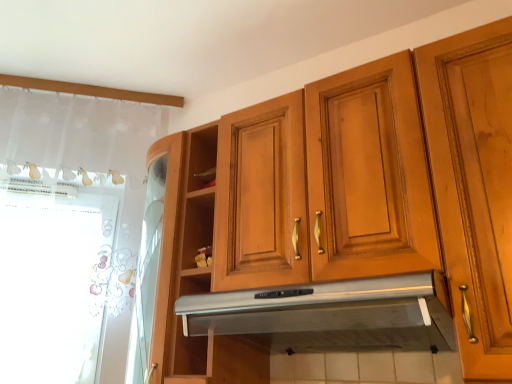
Question: Is silver metallic exhaust hood at center located outside wooden cabinet at upper center?

Choices:
 (A) no
 (B) yes

Answer: (A)

Question: From a real-world perspective, is silver metallic exhaust hood at center beneath wooden cabinet at upper center?

Choices:
 (A) no
 (B) yes

Answer: (B)

Question: From the image's perspective, would you say silver metallic exhaust hood at center is positioned over wooden cabinet at upper center?

Choices:
 (A) yes
 (B) no

Answer: (B)

Question: Can you confirm if silver metallic exhaust hood at center is shorter than wooden cabinet at upper center?

Choices:
 (A) yes
 (B) no

Answer: (A)

Question: Is silver metallic exhaust hood at center positioned far away from wooden cabinet at upper center?

Choices:
 (A) yes
 (B) no

Answer: (B)

Question: Is silver metallic exhaust hood at center at the left side of wooden cabinet at upper center?

Choices:
 (A) no
 (B) yes

Answer: (A)

Question: Does wooden cabinet at upper center turn towards silver metallic exhaust hood at center?

Choices:
 (A) no
 (B) yes

Answer: (B)

Question: Is wooden cabinet at upper center shorter than silver metallic exhaust hood at center?

Choices:
 (A) no
 (B) yes

Answer: (A)

Question: Considering the relative sizes of wooden cabinet at upper center and silver metallic exhaust hood at center in the image provided, is wooden cabinet at upper center bigger than silver metallic exhaust hood at center?

Choices:
 (A) yes
 (B) no

Answer: (A)

Question: Is wooden cabinet at upper center surrounding silver metallic exhaust hood at center?

Choices:
 (A) no
 (B) yes

Answer: (B)

Question: Is wooden cabinet at upper center next to silver metallic exhaust hood at center and touching it?

Choices:
 (A) yes
 (B) no

Answer: (B)

Question: From the image's perspective, is wooden cabinet at upper center located beneath silver metallic exhaust hood at center?

Choices:
 (A) no
 (B) yes

Answer: (A)

Question: Does silver metallic exhaust hood at center have a lesser height compared to white lace curtain at left?

Choices:
 (A) no
 (B) yes

Answer: (B)